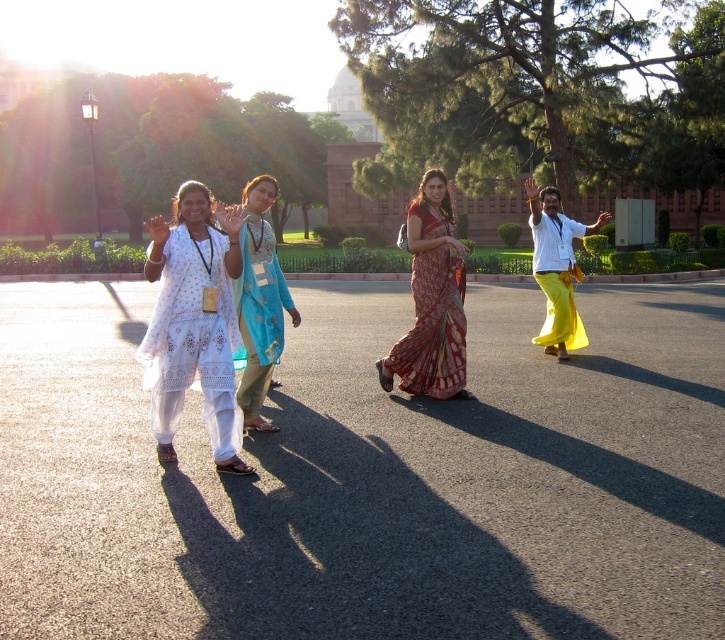
Question: Is white lace kurta at center bigger than yellow cotton saree at right?

Choices:
 (A) yes
 (B) no

Answer: (B)

Question: Which point appears farthest from the camera in this image?

Choices:
 (A) (220, 273)
 (B) (575, 268)
 (C) (428, 193)
 (D) (285, 298)

Answer: (B)

Question: Is white lace kurta at center above printed silk saree at center?

Choices:
 (A) no
 (B) yes

Answer: (A)

Question: Can you confirm if printed silk saree at center is positioned below blue floral dress at center?

Choices:
 (A) no
 (B) yes

Answer: (B)

Question: Which object is farther from the camera taking this photo?

Choices:
 (A) blue floral dress at center
 (B) white lace kurta at center
 (C) yellow cotton saree at right
 (D) printed silk saree at center

Answer: (C)

Question: Which point is farther to the camera?

Choices:
 (A) white lace kurta at center
 (B) printed silk saree at center
 (C) blue floral dress at center
 (D) yellow cotton saree at right

Answer: (D)